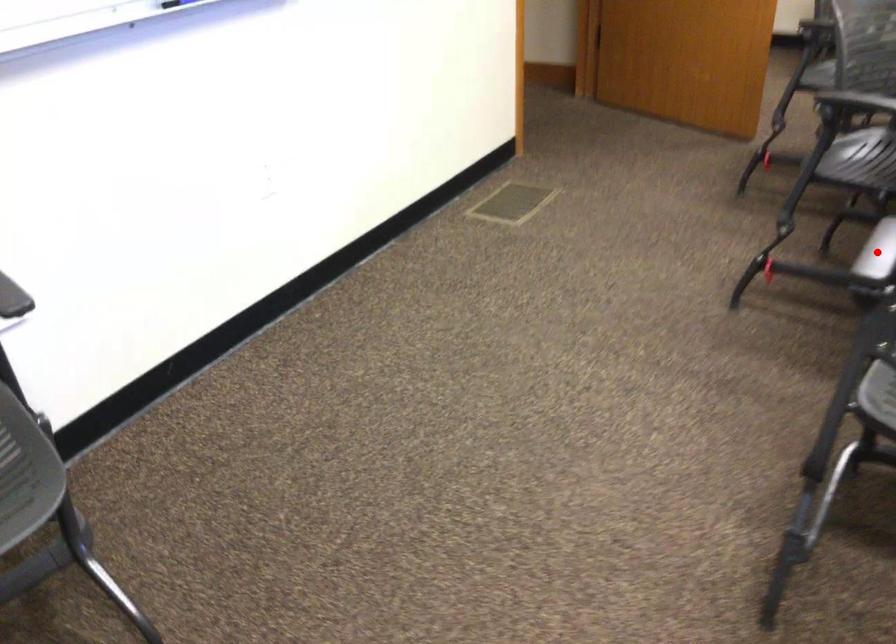
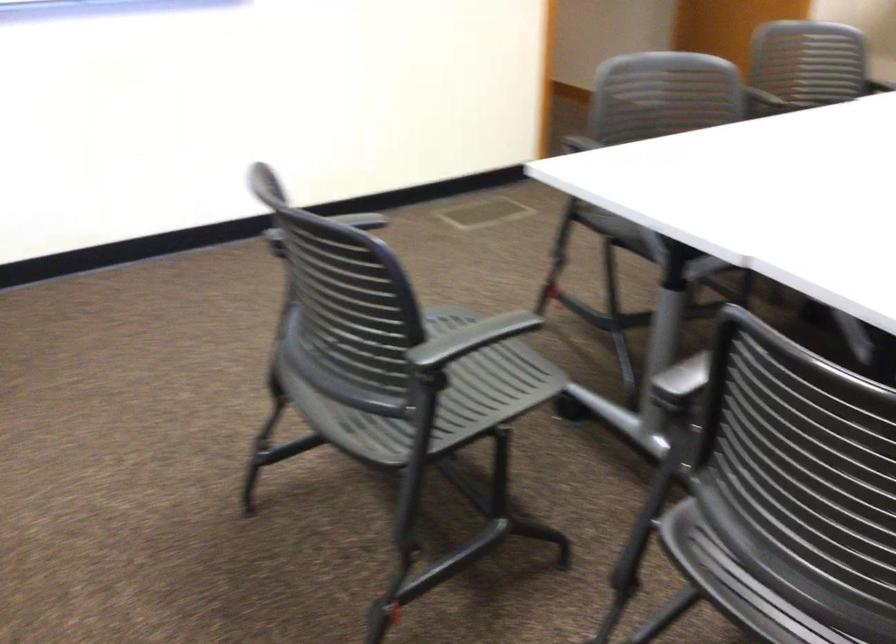
Question: I am providing you with two images of the same scene from different viewpoints. A red point is marked on the first image. At the location where the point appears in image 1, is it still visible in image 2?

Choices:
 (A) Yes
 (B) No

Answer: (B)